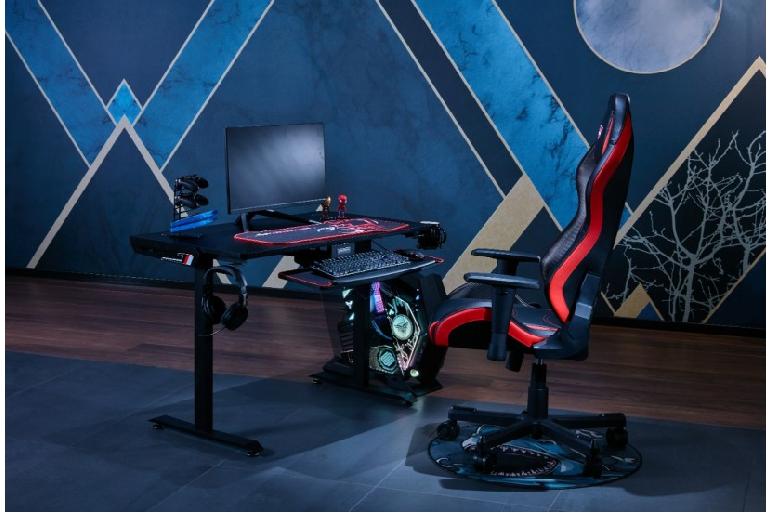
At what (x,y) coordinates should I click in order to perform the action: click on computer monitor screen. Please return your answer as a coordinate pair (x, y). This screenshot has height=512, width=768. Looking at the image, I should click on (290, 170).